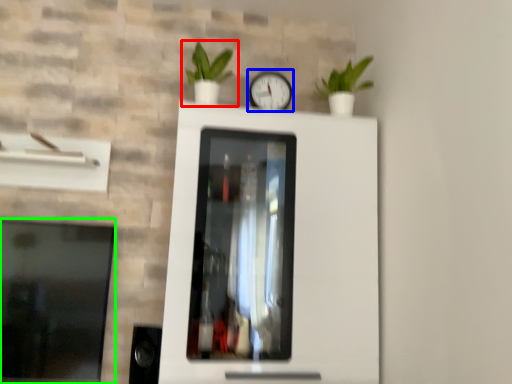
Question: Estimate the real-world distances between objects in this image. Which object is farther from houseplant (highlighted by a red box), clock (highlighted by a blue box) or window (highlighted by a green box)?

Choices:
 (A) clock
 (B) window

Answer: (B)